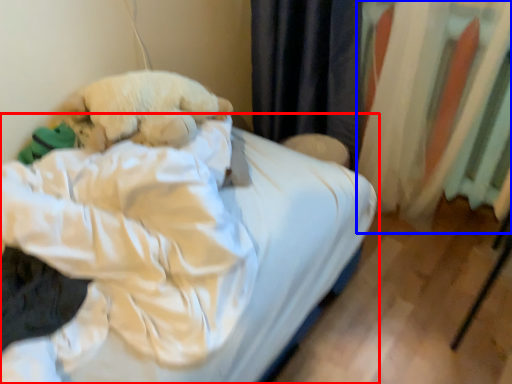
Question: Among these objects, which one is farthest to the camera, bed (highlighted by a red box) or curtain (highlighted by a blue box)?

Choices:
 (A) bed
 (B) curtain

Answer: (B)